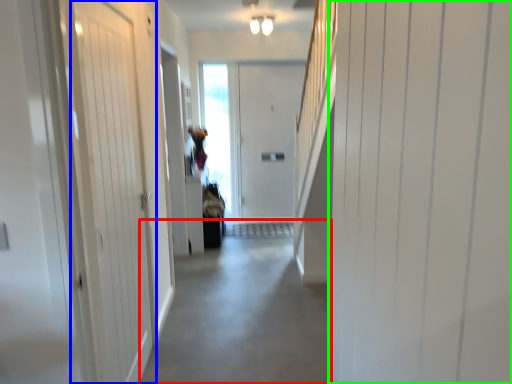
Question: Estimate the real-world distances between objects in this image. Which object is closer to alley (highlighted by a red box), door (highlighted by a blue box) or door (highlighted by a green box)?

Choices:
 (A) door
 (B) door

Answer: (A)